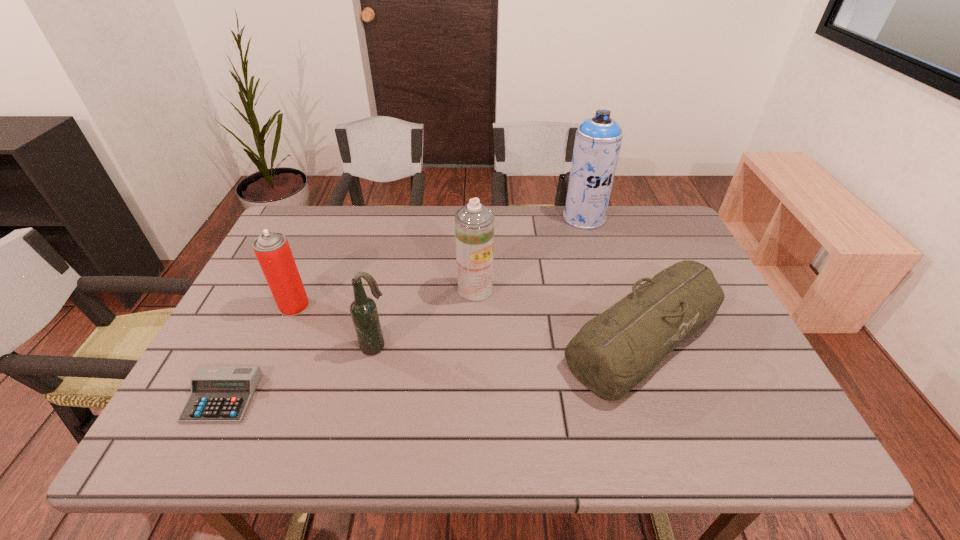
The height and width of the screenshot is (540, 960). I want to click on blank area located 0.120m on the front of the beer bottle, so click(x=362, y=402).

At what (x,y) coordinates should I click in order to perform the action: click on vacant space located 0.320m on the back of the duffel bag. Please return your answer as a coordinate pair (x, y). Looking at the image, I should click on (601, 217).

Find the location of a particular element. This screenshot has width=960, height=540. free location located on the right of the shortest object is located at coordinates (290, 397).

This screenshot has height=540, width=960. Identify the location of object at the far edge. (598, 139).

The height and width of the screenshot is (540, 960). In order to click on object located at the near edge in this screenshot , I will do `click(219, 394)`.

What are the coordinates of `aerosol can at the left edge` in the screenshot? It's located at (272, 249).

Find the location of a particular element. This screenshot has width=960, height=540. calculator positioned at the left edge is located at coordinates (219, 394).

Find the location of a particular element. This screenshot has height=540, width=960. object that is at the right edge is located at coordinates (612, 353).

You are a GUI agent. You are given a task and a screenshot of the screen. Output one action in this format:
    pyautogui.click(x=<x>, y=<y>)
    Task: Click on the object at the near left corner
    
    Given the screenshot: What is the action you would take?
    pyautogui.click(x=219, y=394)

The height and width of the screenshot is (540, 960). I want to click on vacant space at the far edge, so pos(391,238).